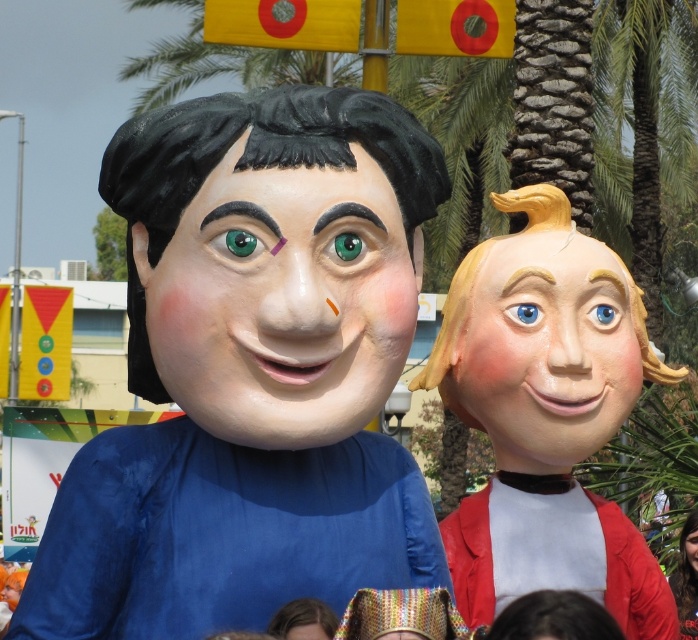
You are an artist trying to paint the scene. You need to decide the vertical positioning of the smooth yellow hair at right and the smooth skin face at center. Based on their heights, which one should you place lower on the canvas?

The smooth yellow hair at right has a lesser height compared to the smooth skin face at center, so it should be placed lower on the canvas.

Based on the photo, you are standing in front of the two festive figures and want to determine which point is nearer to you. The points are labeled as point (235, 200) and point (690, 541). Which point is closer to you?

Point (235, 200) is closer to the viewer than point (690, 541).

You are a photographer at the event and want to capture both the matte blue costume at center and the smooth skin face at center in your shot. Which object should you focus on first to ensure both are in focus?

The matte blue costume at center is closer to the viewer than the smooth skin face at center. To ensure both are in focus, you should focus on the matte blue costume at center first, as it is closer, and the smooth skin face at center will be in focus as it is further away.